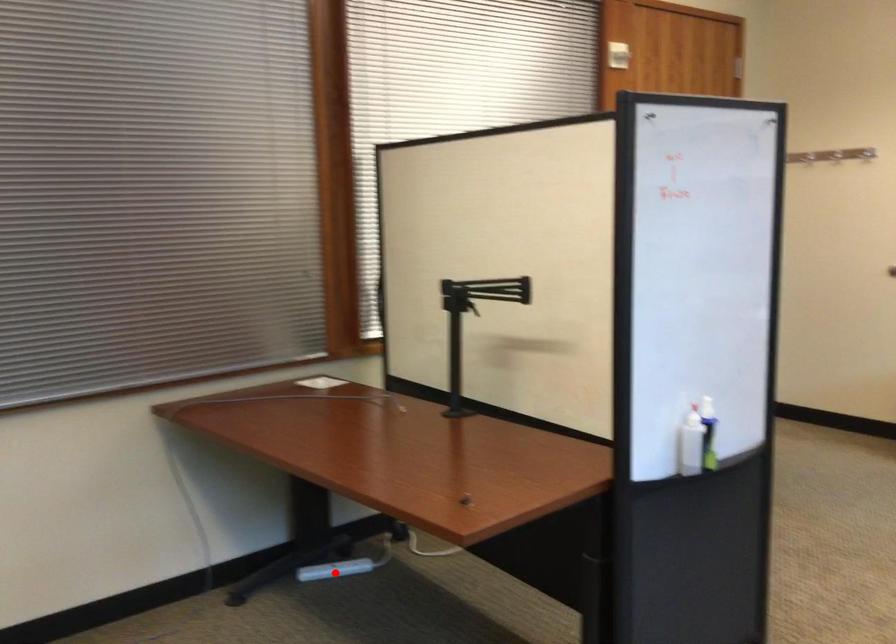
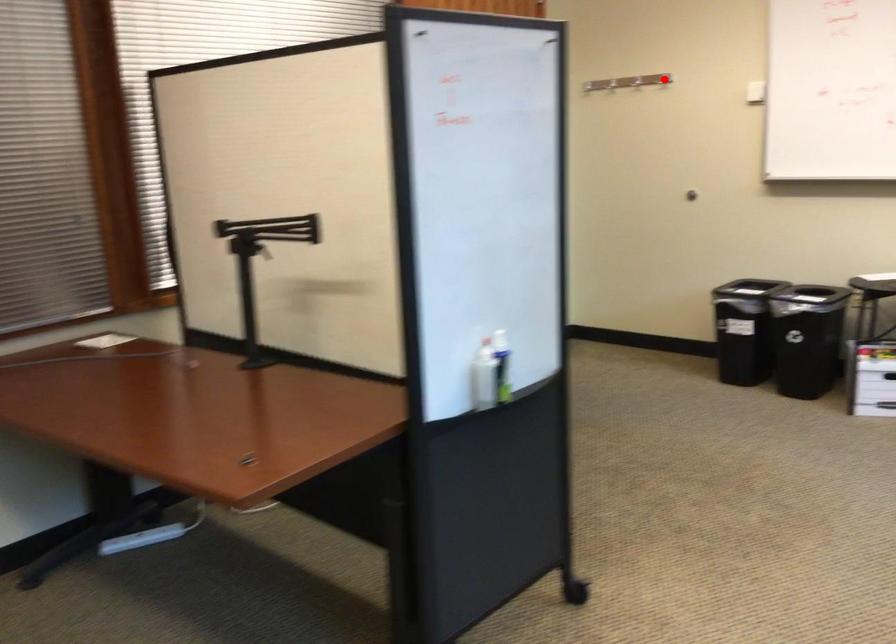
I am providing you with two images of the same scene from different viewpoints. A red point is marked on the first image and another point is marked on the second image. Are the points marked in image1 and image2 representing the same 3D position?

No